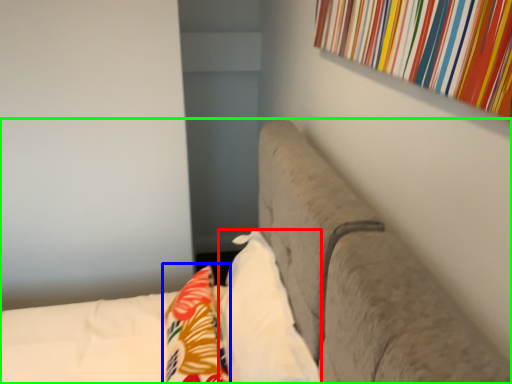
Question: Estimate the real-world distances between objects in this image. Which object is farther from pillow (highlighted by a red box), throw pillow (highlighted by a blue box) or furniture (highlighted by a green box)?

Choices:
 (A) throw pillow
 (B) furniture

Answer: (B)